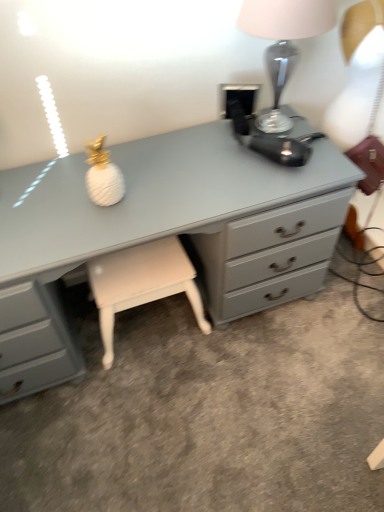
Locate an element on the screen. free spot to the left of satin silver lamp at upper right is located at coordinates (198, 150).